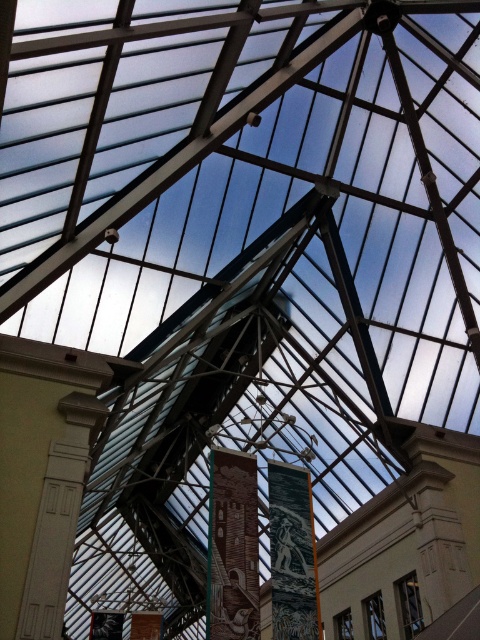
Question: Which object is closer to the camera taking this photo?

Choices:
 (A) dark green textured tapestry at center
 (B) brick textured pillar at center

Answer: (B)

Question: Among these objects, which one is nearest to the camera?

Choices:
 (A) brick textured pillar at center
 (B) white carved stone pillar at left
 (C) dark green textured tapestry at center

Answer: (B)

Question: Is brick textured pillar at center further to the viewer compared to dark green textured tapestry at center?

Choices:
 (A) yes
 (B) no

Answer: (B)

Question: Does white carved stone pillar at left appear on the left side of brick textured pillar at center?

Choices:
 (A) yes
 (B) no

Answer: (A)

Question: Can you confirm if white carved stone pillar at left is bigger than dark green textured tapestry at center?

Choices:
 (A) yes
 (B) no

Answer: (B)

Question: Estimate the real-world distances between objects in this image. Which object is farther from the dark green textured tapestry at center?

Choices:
 (A) white carved stone pillar at left
 (B) brick textured pillar at center

Answer: (A)